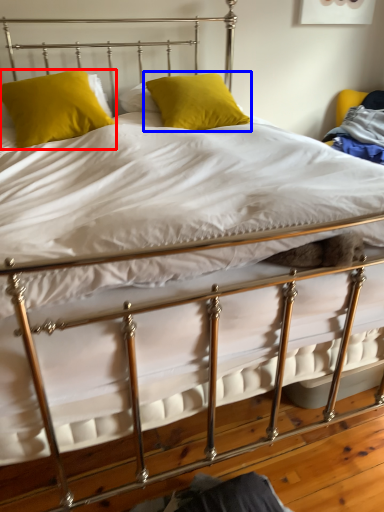
Question: Among these objects, which one is farthest to the camera, pillow (highlighted by a red box) or pillow (highlighted by a blue box)?

Choices:
 (A) pillow
 (B) pillow

Answer: (B)